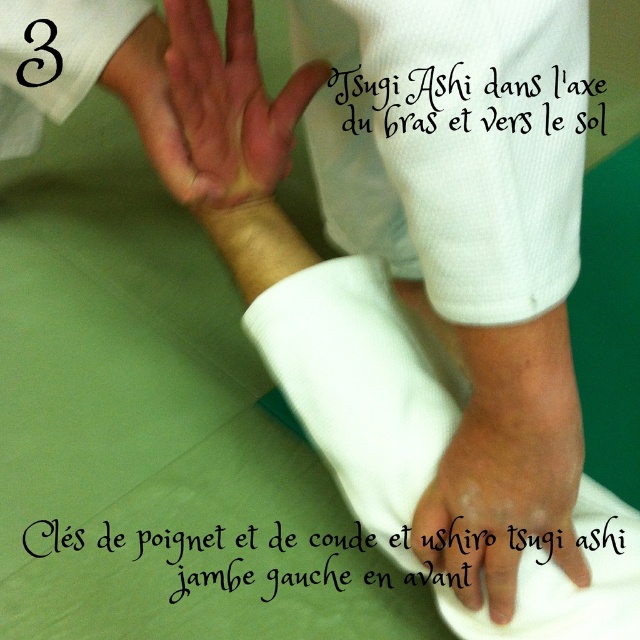
Which is behind, point (552, 444) or point (211, 147)?

The point (211, 147) is behind.

Between point (547, 540) and point (248, 129), which one is positioned in front?

Point (547, 540) is more forward.

Is point (458, 522) in front of point (285, 128)?

Yes, point (458, 522) is closer to viewer.

This screenshot has width=640, height=640. Find the location of `white matte hand at center`. white matte hand at center is located at coordinates (502, 496).